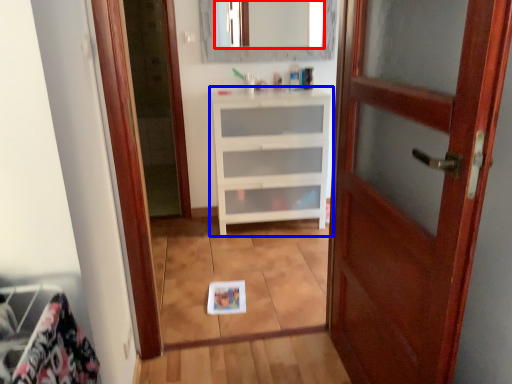
Question: Which object appears closest to the camera in this image, mirror (highlighted by a red box) or chest of drawers (highlighted by a blue box)?

Choices:
 (A) mirror
 (B) chest of drawers

Answer: (B)